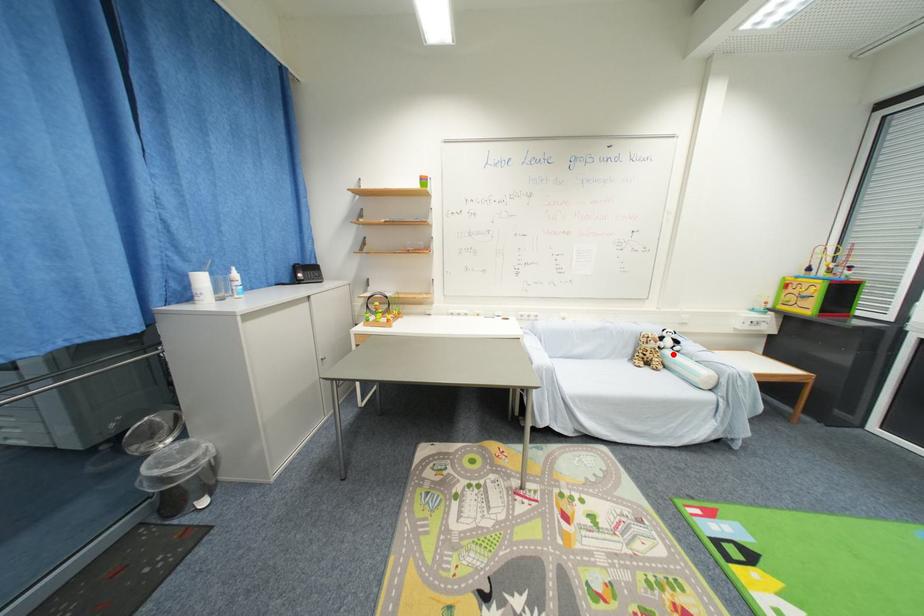
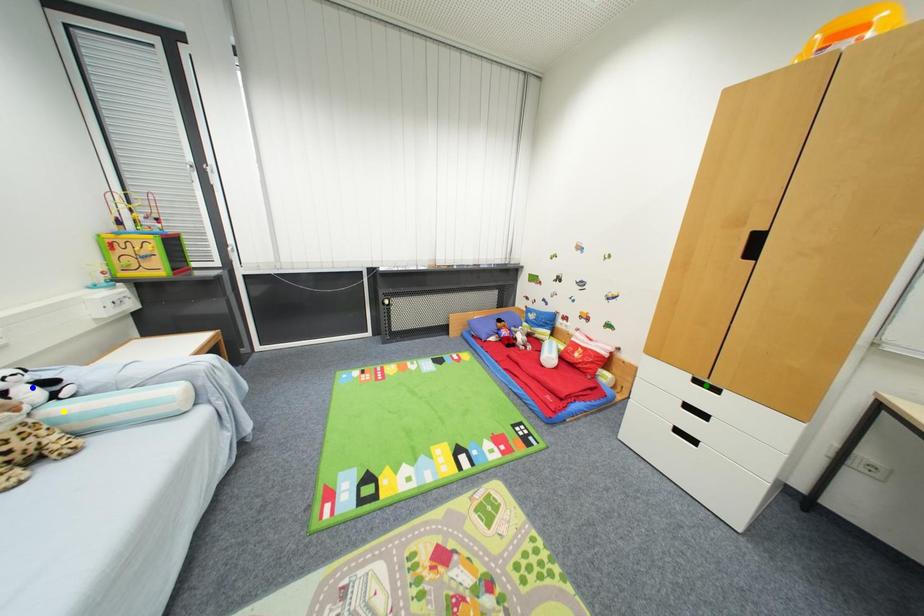
Question: I am providing you with two images of the same scene from different viewpoints. A red point is marked on the first image. You are given multiple points on the second image. Which spot in image 2 lines up with the point in image 1?

Choices:
 (A) green point
 (B) yellow point
 (C) blue point

Answer: (B)